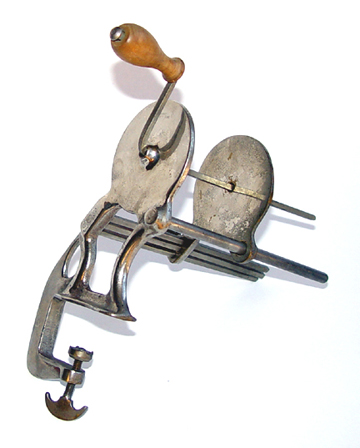
This screenshot has height=448, width=360. Find the location of `screws`. screws is located at coordinates (118, 31), (154, 156), (76, 353).